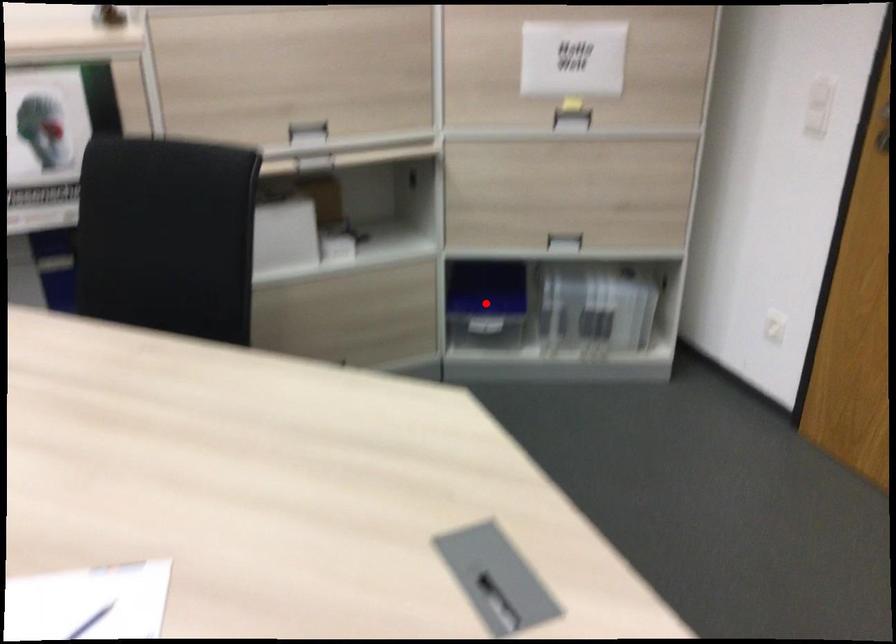
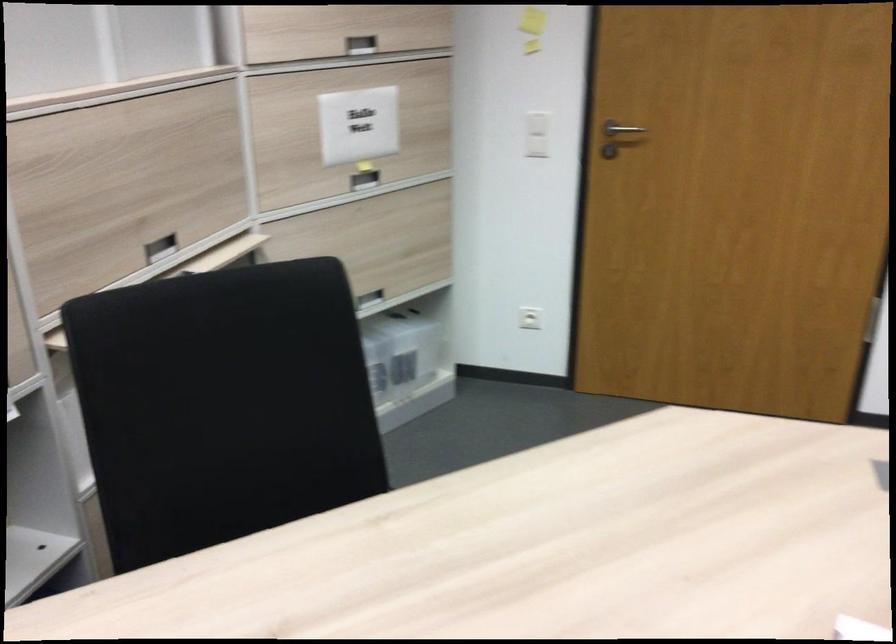
Question: I am providing you with two images of the same scene from different viewpoints. A red point is marked on the first image. Can you still see the location of the red point in image 2?

Choices:
 (A) Yes
 (B) No

Answer: (B)